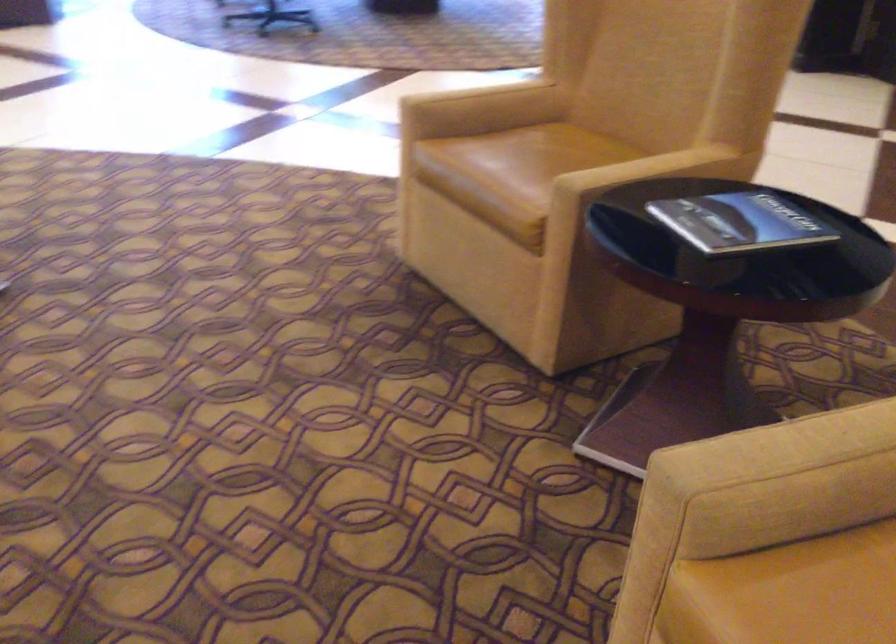
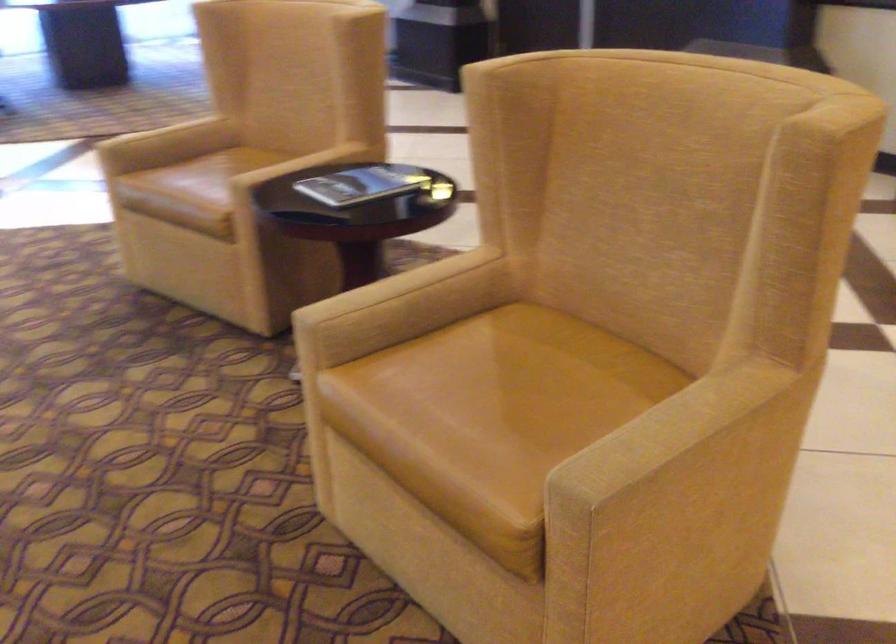
Locate, in the second image, the point that corresponds to the point at 510,158 in the first image.

(199, 176)